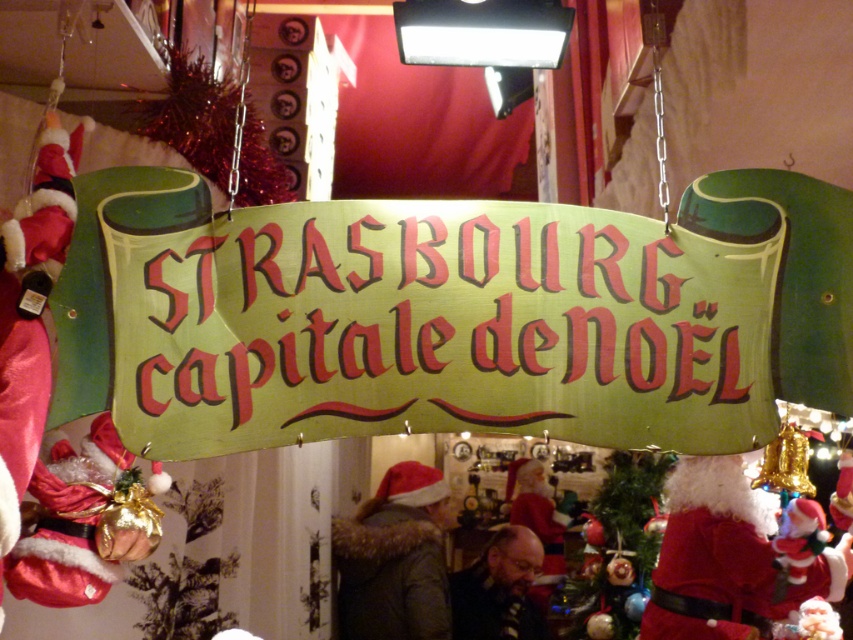
Question: Which of the following is the farthest from the observer?

Choices:
 (A) green paper sign at center
 (B) red velvet santa claus at center

Answer: (B)

Question: Does green paper sign at center appear on the left side of red velvet santa claus at center?

Choices:
 (A) yes
 (B) no

Answer: (A)

Question: Which point is farther from the camera taking this photo?

Choices:
 (A) (146, 284)
 (B) (727, 572)

Answer: (B)

Question: Which object is farther from the camera taking this photo?

Choices:
 (A) green paper sign at center
 (B) red velvet santa claus at center

Answer: (B)

Question: Does green paper sign at center appear on the left side of red velvet santa claus at center?

Choices:
 (A) yes
 (B) no

Answer: (A)

Question: Is green paper sign at center behind red velvet santa claus at center?

Choices:
 (A) no
 (B) yes

Answer: (A)